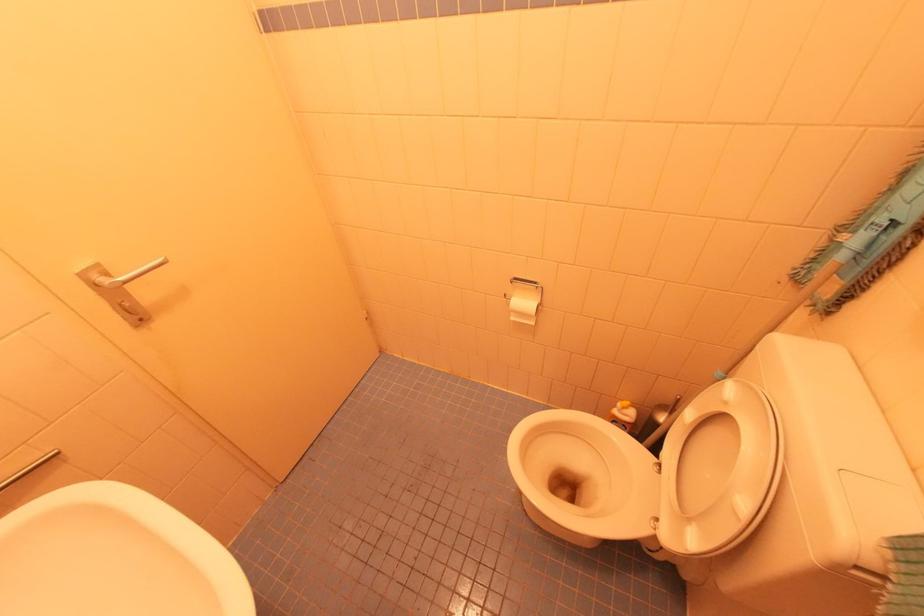
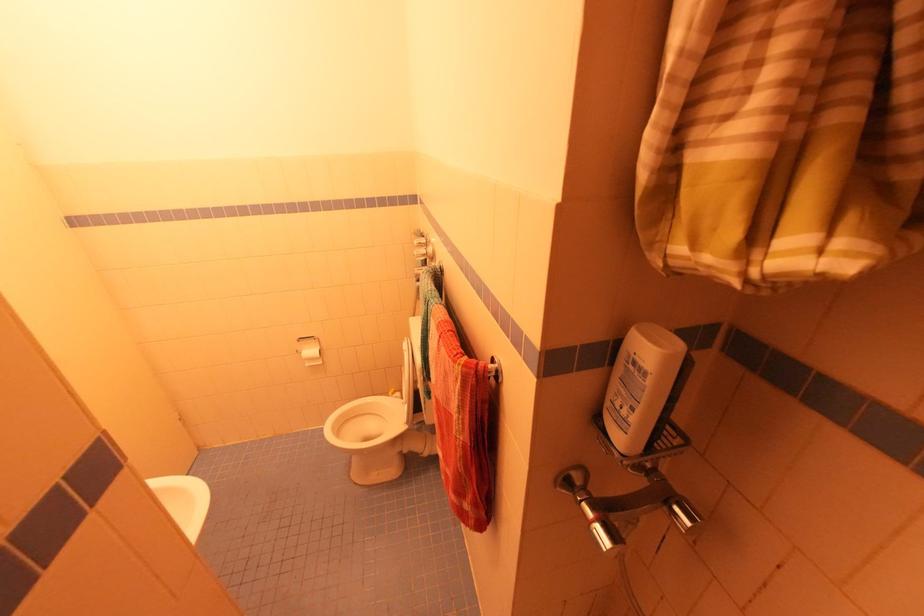
Question: The camera is either moving clockwise (left) or counter-clockwise (right) around the object. The first image is from the beginning of the video and the second image is from the end. Is the camera moving left or right when shooting the video?

Choices:
 (A) Left
 (B) Right

Answer: (A)